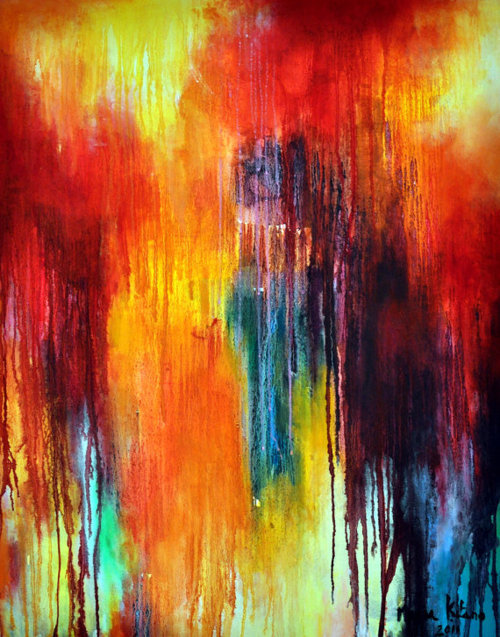
Identify the location of picture. (261, 380).